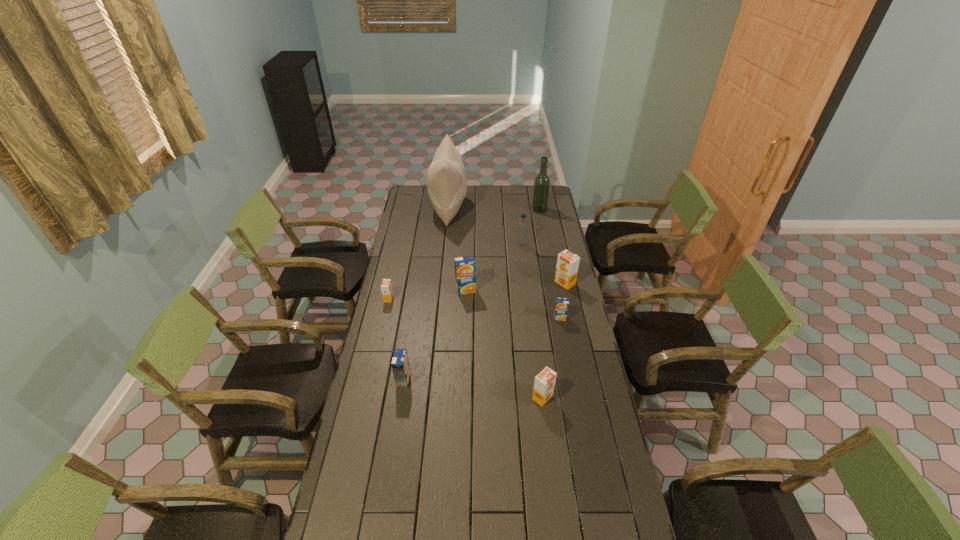
This screenshot has width=960, height=540. Identify the location of free region that satisfies the following two spatial constraints: 1. on the front side of the biggest blue orange_juice; 2. on the right side of the cushion. (441, 290).

At what (x,y) coordinates should I click in order to perform the action: click on free space that satisfies the following two spatial constraints: 1. on the front side of the cushion; 2. on the right side of the farthest orange orange juice. Please return your answer as a coordinate pair (x, y). The width and height of the screenshot is (960, 540). Looking at the image, I should click on (442, 283).

Identify the location of free spot that satisfies the following two spatial constraints: 1. on the front side of the cushion; 2. on the right side of the liquor. (448, 210).

Image resolution: width=960 pixels, height=540 pixels. I want to click on free spot that satisfies the following two spatial constraints: 1. on the back side of the third farthest object; 2. on the right side of the second farthest orange orange juice, so click(400, 245).

Identify the location of free space in the image that satisfies the following two spatial constraints: 1. on the back side of the farthest orange orange juice; 2. on the left side of the third nearest object. (553, 283).

I want to click on vacant space that satisfies the following two spatial constraints: 1. on the back side of the rightmost orange orange juice; 2. on the right side of the fourth orange_juice from left to right, so click(x=528, y=283).